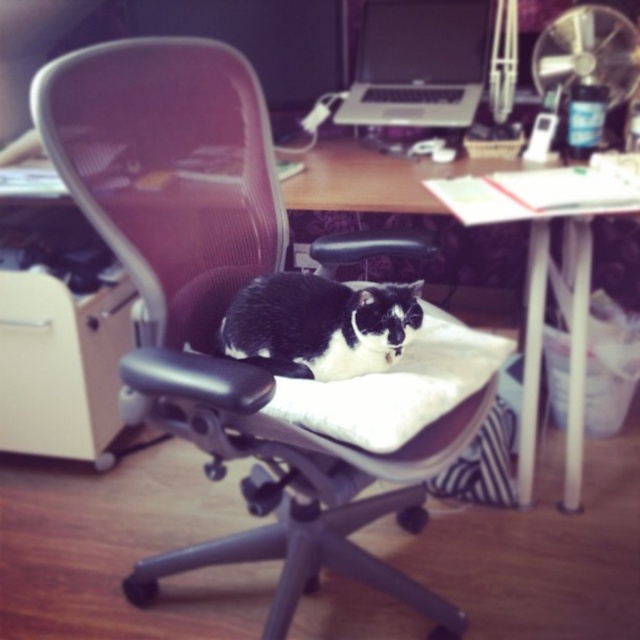
Between point (298, 262) and point (291, 289), which one is positioned in front?

Positioned in front is point (291, 289).

Can you confirm if wooden desk at center is wider than black/white fur cat at center?

Indeed, wooden desk at center has a greater width compared to black/white fur cat at center.

The height and width of the screenshot is (640, 640). What are the coordinates of `wooden desk at center` in the screenshot? It's located at (372, 180).

The width and height of the screenshot is (640, 640). Find the location of `wooden desk at center`. wooden desk at center is located at coordinates (372, 180).

This screenshot has width=640, height=640. Describe the element at coordinates (372, 180) in the screenshot. I see `wooden desk at center` at that location.

Who is positioned more to the right, wooden desk at center or black glossy monitor at upper center?

From the viewer's perspective, wooden desk at center appears more on the right side.

At what (x,y) coordinates should I click in order to perform the action: click on wooden desk at center. Please return your answer as a coordinate pair (x, y). Looking at the image, I should click on (372, 180).

Does black/white fur cat at center have a larger size compared to black glossy monitor at upper center?

Incorrect, black/white fur cat at center is not larger than black glossy monitor at upper center.

Identify the location of black/white fur cat at center. (320, 324).